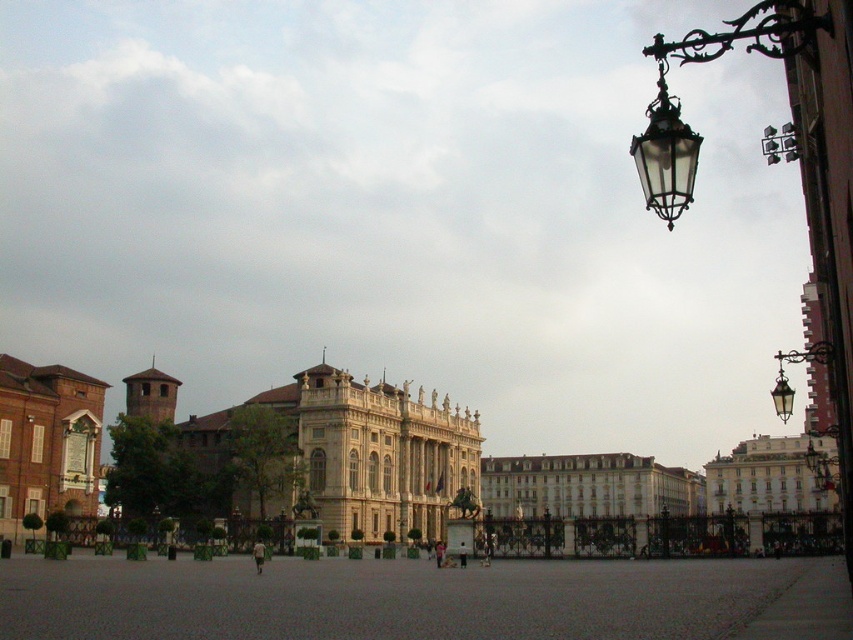
You are an architect designing a new urban plaza. You need to ensure that the white glossy building at center and the brick wall at left are positioned correctly according to the city ordinance that requires all main buildings to be placed higher than adjacent structures. Does the current arrangement comply with the ordinance?

The white glossy building at center is below the brick wall at left, so it does not comply with the city ordinance requiring main buildings to be placed higher than adjacent structures.